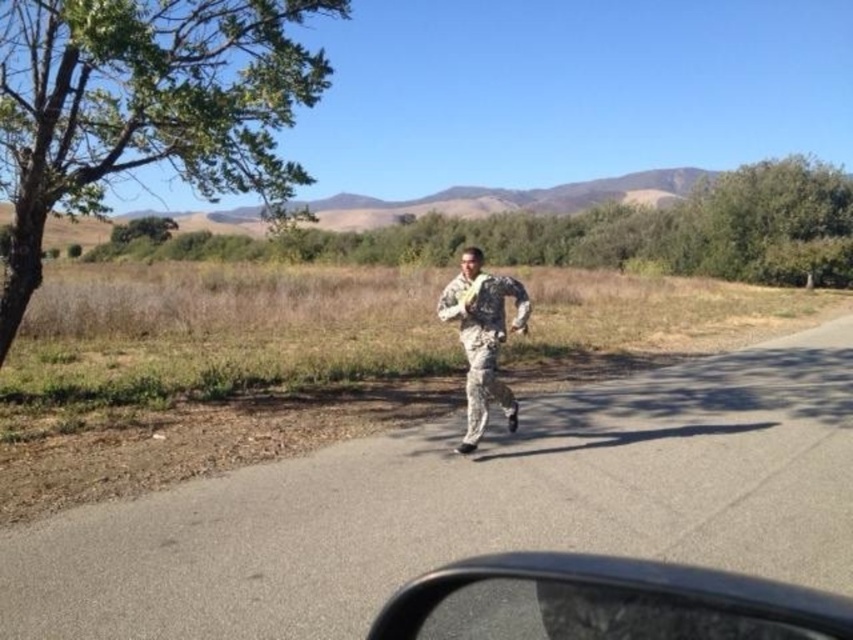
You are a photographer standing at the transparent plastic car window at lower center. You want to take a photo of the camouflage fabric soldier at center. Is the soldier within your camera lens range if the camera can focus up to 100 meters?

The transparent plastic car window at lower center is 84.79 meters from camouflage fabric soldier at center. Since the camera can focus up to 100 meters, the soldier is within the camera lens range.

You are a photographer standing inside the car with the transparent plastic car window at lower center. You want to take a photo of the camouflage fabric soldier at center. Can you see the entire soldier through the window?

The transparent plastic car window at lower center is not as tall as camouflage fabric soldier at center, so you cannot see the entire soldier through the window.

You are a photographer trying to capture a clear photo of the camouflage fabric soldier at center through the transparent plastic car window at lower center. Considering the sizes of both objects, will the soldier fit entirely within the view of the window?

The transparent plastic car window at lower center is wider than the camouflage fabric soldier at center, so the soldier will fit entirely within the view of the window.